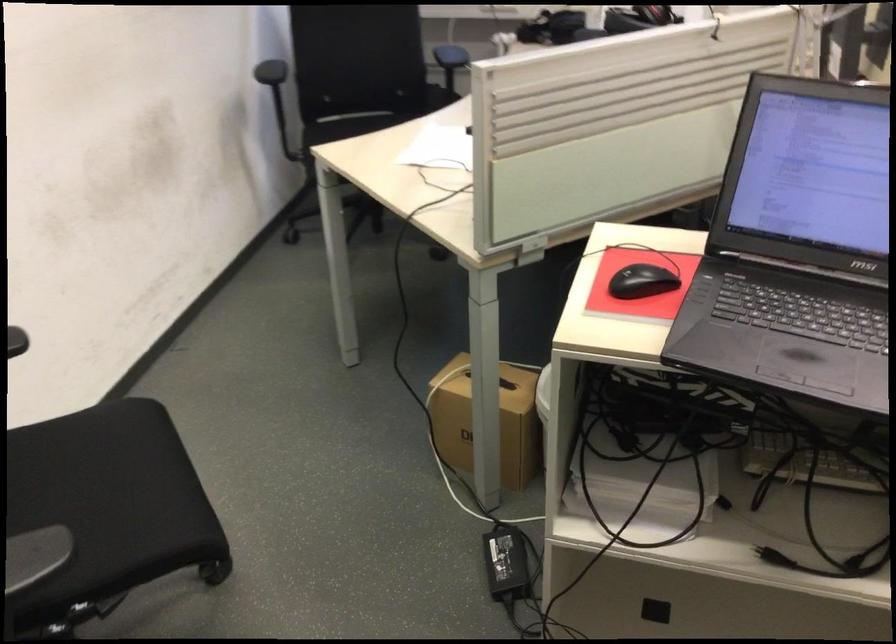
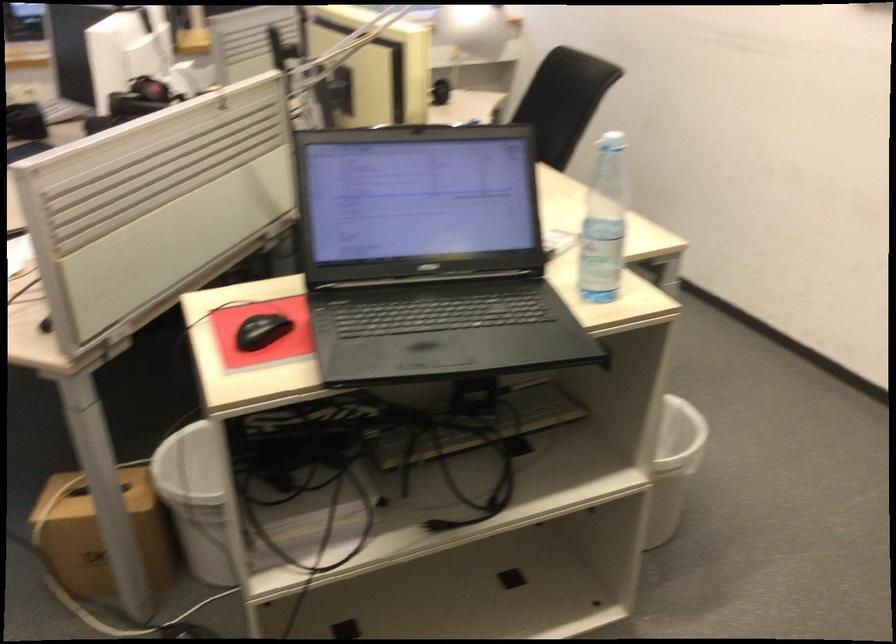
Question: The first image is from the beginning of the video and the second image is from the end. How did the camera likely rotate when shooting the video?

Choices:
 (A) Left
 (B) Right
 (C) Up
 (D) Down

Answer: (B)